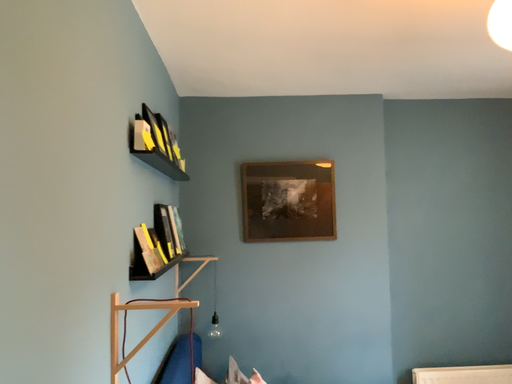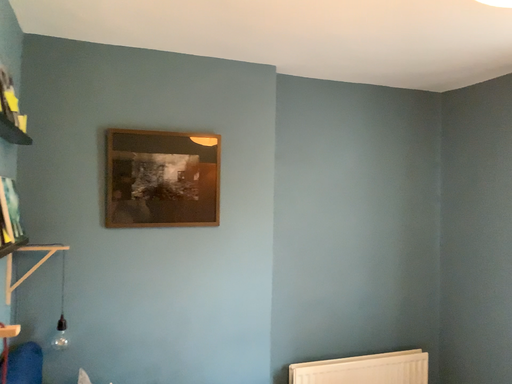
Question: Which way did the camera rotate in the video?

Choices:
 (A) rotated right
 (B) rotated left

Answer: (A)